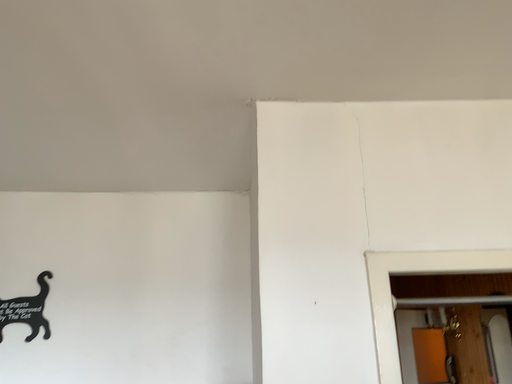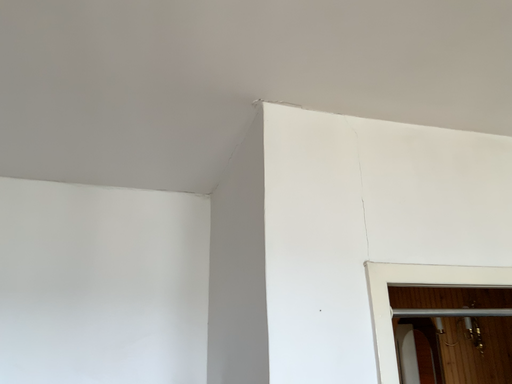
Question: Which way did the camera rotate in the video?

Choices:
 (A) rotated left
 (B) rotated right

Answer: (B)